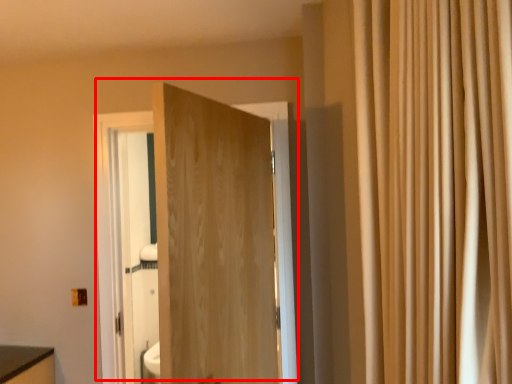
Question: From the image's perspective, considering the relative positions of door (annotated by the red box) and curtain in the image provided, where is door (annotated by the red box) located with respect to the staircase?

Choices:
 (A) above
 (B) below

Answer: (B)